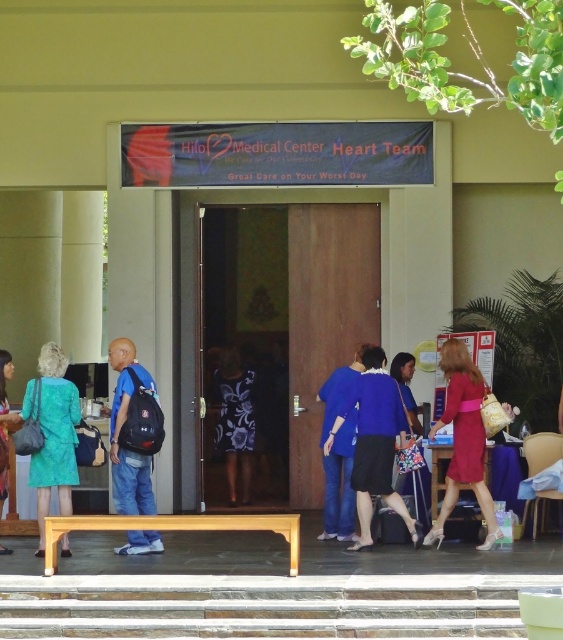
Describe the element at coordinates (55, 436) in the screenshot. The width and height of the screenshot is (563, 640). I see `teal fabric dress at left` at that location.

Is teal fabric dress at left to the left of floral dress at center from the viewer's perspective?

Indeed, teal fabric dress at left is positioned on the left side of floral dress at center.

Is point (55, 349) positioned in front of point (230, 500)?

Yes.

In order to click on teal fabric dress at left in this screenshot , I will do `click(55, 436)`.

Which is above, gray stone stairs at center or floral dress at center?

floral dress at center

Can you confirm if gray stone stairs at center is positioned to the left of floral dress at center?

Incorrect, gray stone stairs at center is not on the left side of floral dress at center.

The height and width of the screenshot is (640, 563). In order to click on gray stone stairs at center in this screenshot , I will do `click(263, 605)`.

Which of these two, wooden door at center or blue fabric jacket at center, stands taller?

With more height is wooden door at center.

Is point (302, 339) closer to camera compared to point (334, 499)?

No, (302, 339) is further to viewer.

Is point (319, 413) in front of point (346, 481)?

No, it is behind (346, 481).

The width and height of the screenshot is (563, 640). Identify the location of wooden door at center. (283, 332).